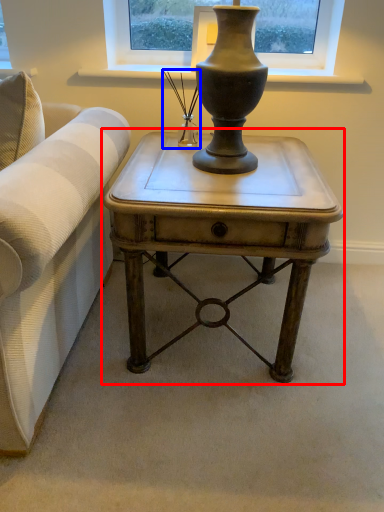
Question: Which object is further to the camera taking this photo, table (highlighted by a red box) or candle holder (highlighted by a blue box)?

Choices:
 (A) table
 (B) candle holder

Answer: (B)